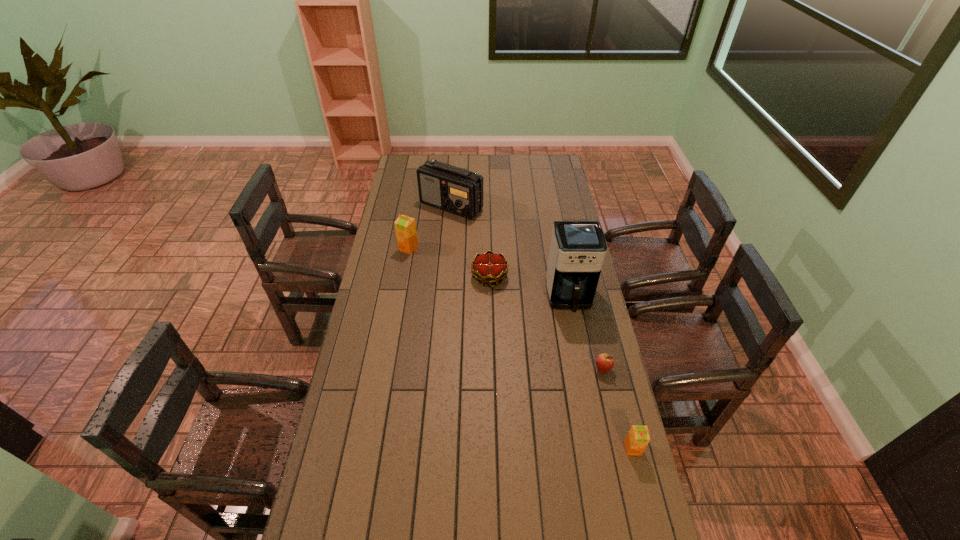
If equal spacing is desired by inserting an extra orange_juice among them, please point out a free spot for this new orange_juice. Please provide its 2D coordinates. Your answer should be formatted as a tuple, i.e. [(x, y)], where the tuple contains the x and y coordinates of a point satisfying the conditions above.

[(499, 329)]